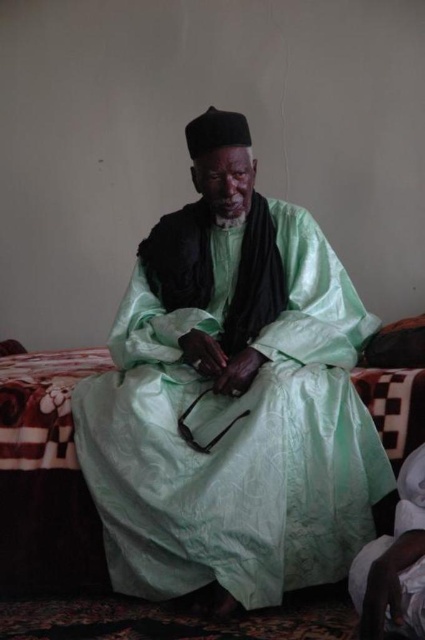
Who is shorter, matte green silk robe at center or patterned fabric bed at center?

With less height is patterned fabric bed at center.

Measure the distance between matte green silk robe at center and camera.

5.49 feet

Is point (254, 321) positioned before point (56, 406)?

No.

Locate an element on the screen. The height and width of the screenshot is (640, 425). matte green silk robe at center is located at coordinates (232, 397).